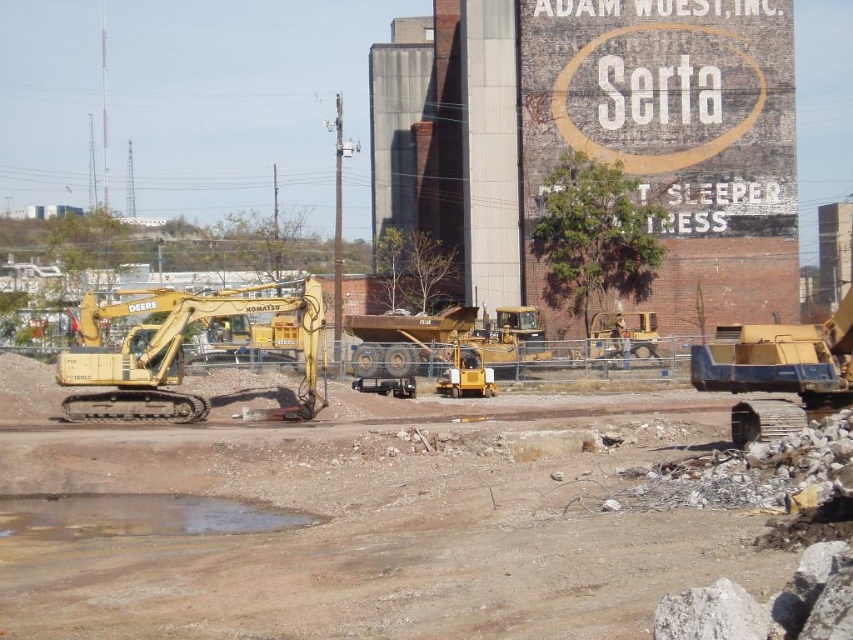
Can you confirm if yellow metallic excavator at right is positioned below yellow metallic bulldozer at center?

No.

You are a GUI agent. You are given a task and a screenshot of the screen. Output one action in this format:
    pyautogui.click(x=<x>, y=<y>)
    Task: Click on the yellow metallic excavator at right
    
    Given the screenshot: What is the action you would take?
    pyautogui.click(x=778, y=371)

Measure the distance between point (x=750, y=406) and camera.

Point (x=750, y=406) and camera are 120.69 feet apart.

Where is `yellow metallic excavator at right`? This screenshot has height=640, width=853. yellow metallic excavator at right is located at coordinates (778, 371).

Does brown dirt field at center appear under yellow metallic excavator at right?

Correct, brown dirt field at center is located below yellow metallic excavator at right.

Find the location of a particular element. brown dirt field at center is located at coordinates (383, 525).

Can you confirm if yellow metallic excavator at left is bigger than yellow metallic bulldozer at center?

Yes, yellow metallic excavator at left is bigger than yellow metallic bulldozer at center.

Does yellow metallic excavator at left appear on the left side of yellow metallic bulldozer at center?

Indeed, yellow metallic excavator at left is positioned on the left side of yellow metallic bulldozer at center.

Is point (144, 340) closer to camera compared to point (637, 324)?

Yes.

You are a GUI agent. You are given a task and a screenshot of the screen. Output one action in this format:
    pyautogui.click(x=<x>, y=<y>)
    Task: Click on the yellow metallic excavator at left
    Image resolution: width=853 pixels, height=640 pixels.
    Given the screenshot: What is the action you would take?
    (175, 353)